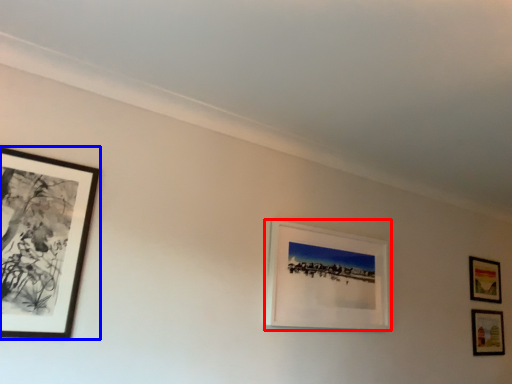
Question: Which object appears closest to the camera in this image, picture frame (highlighted by a red box) or picture frame (highlighted by a blue box)?

Choices:
 (A) picture frame
 (B) picture frame

Answer: (B)